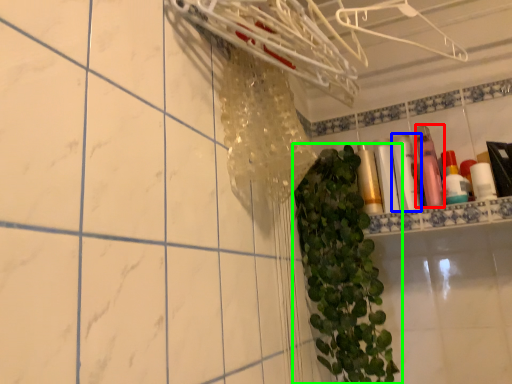
Question: Which object is the closest to the toiletry (highlighted by a red box)? Choose among these: toiletry (highlighted by a blue box) or houseplant (highlighted by a green box).

Choices:
 (A) toiletry
 (B) houseplant

Answer: (A)